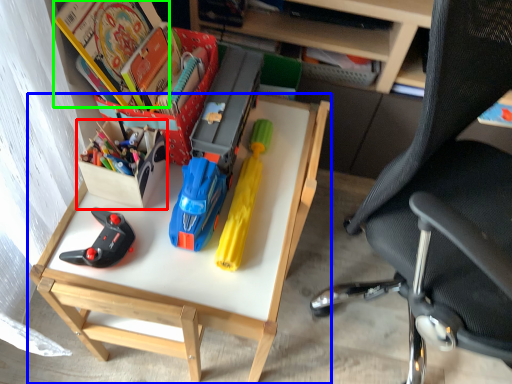
Question: Estimate the real-world distances between objects in this image. Which object is farther from kit (highlighted by a red box), desk (highlighted by a blue box) or book (highlighted by a green box)?

Choices:
 (A) desk
 (B) book

Answer: (A)